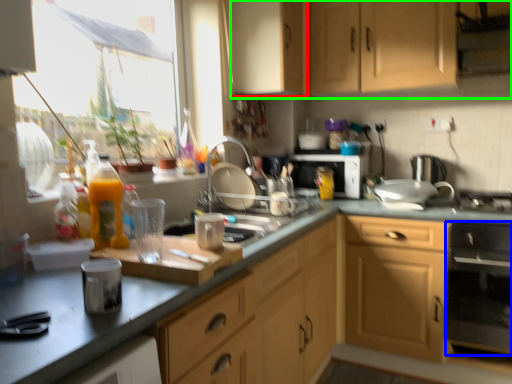
Question: Which is nearer to the cabinetry (highlighted by a red box)? kitchen appliance (highlighted by a blue box) or cabinetry (highlighted by a green box).

Choices:
 (A) kitchen appliance
 (B) cabinetry

Answer: (B)